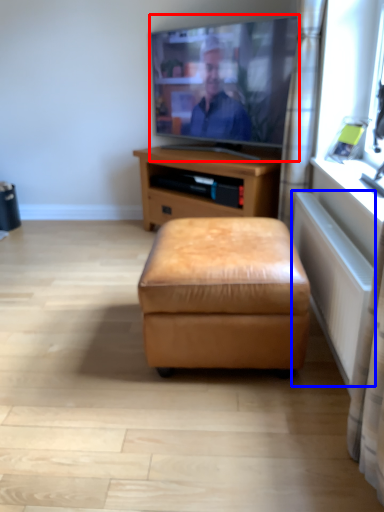
Question: Among these objects, which one is nearest to the camera, television (highlighted by a red box) or radiator (highlighted by a blue box)?

Choices:
 (A) television
 (B) radiator

Answer: (B)